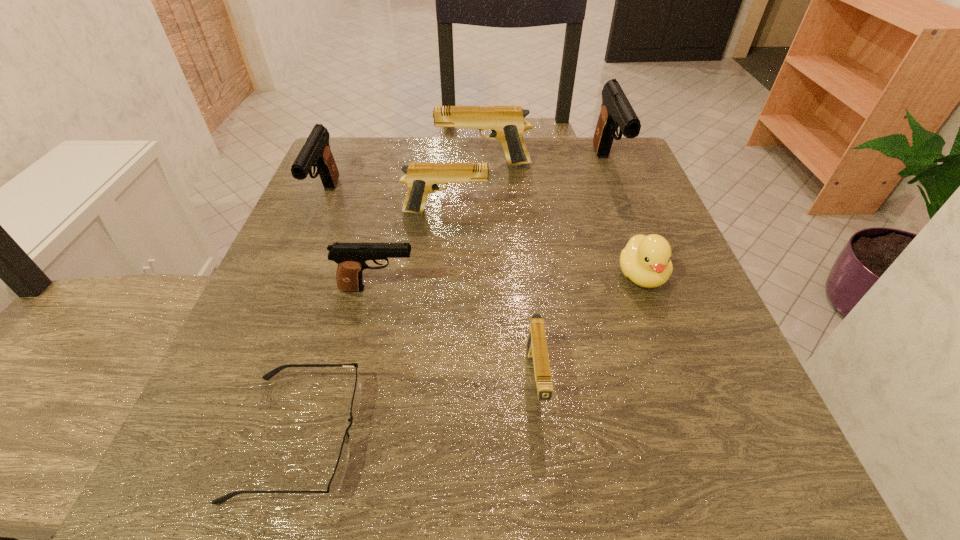
The height and width of the screenshot is (540, 960). What are the coordinates of `the biggest black pistol` in the screenshot? It's located at (616, 112).

You are a GUI agent. You are given a task and a screenshot of the screen. Output one action in this format:
    pyautogui.click(x=<x>, y=<y>)
    Task: Click on the tallest pistol
    
    Given the screenshot: What is the action you would take?
    pyautogui.click(x=616, y=112)

Where is `the biggest tan pistol`? The height and width of the screenshot is (540, 960). the biggest tan pistol is located at coordinates (507, 123).

You are a GUI agent. You are given a task and a screenshot of the screen. Output one action in this format:
    pyautogui.click(x=<x>, y=<y>)
    Task: Click on the leftmost black pistol
    The image size is (960, 540).
    Given the screenshot: What is the action you would take?
    pyautogui.click(x=316, y=152)

Locate an element on the screen. This screenshot has width=960, height=540. the second biggest black pistol is located at coordinates (316, 152).

You are a GUI agent. You are given a task and a screenshot of the screen. Output one action in this format:
    pyautogui.click(x=<x>, y=<y>)
    Task: Click on the second farthest tan pistol
    The image size is (960, 540).
    Given the screenshot: What is the action you would take?
    pyautogui.click(x=421, y=178)

This screenshot has width=960, height=540. What are the coordinates of `the nearest black pistol` in the screenshot? It's located at (350, 257).

At what (x,y) coordinates should I click in order to perform the action: click on the fifth farthest pistol. Please return your answer as a coordinate pair (x, y). Looking at the image, I should click on (350, 257).

You are a GUI agent. You are given a task and a screenshot of the screen. Output one action in this format:
    pyautogui.click(x=<x>, y=<y>)
    Task: Click on the duckling
    Image resolution: width=960 pixels, height=540 pixels.
    Given the screenshot: What is the action you would take?
    pyautogui.click(x=646, y=260)

The image size is (960, 540). I want to click on the smallest tan pistol, so click(537, 351).